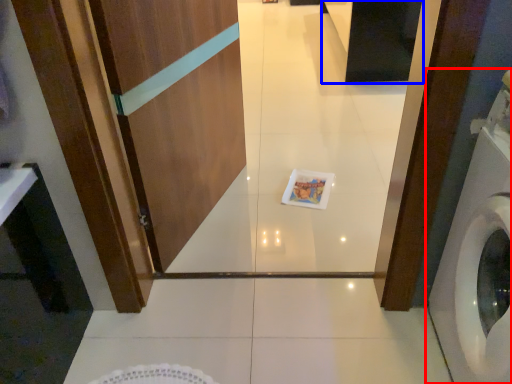
Question: Which point is further to the camera, washing machine (highlighted by a red box) or cabinetry (highlighted by a blue box)?

Choices:
 (A) washing machine
 (B) cabinetry

Answer: (B)